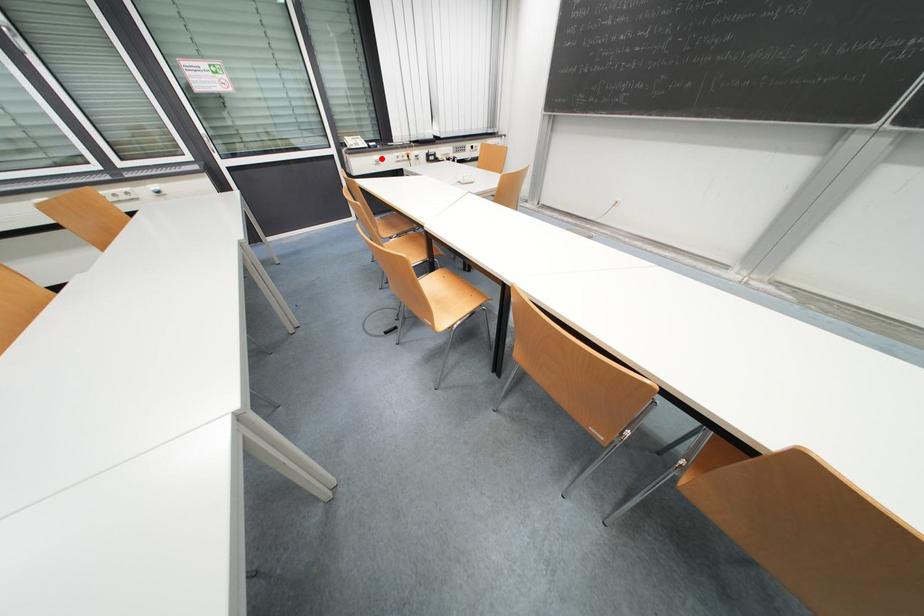
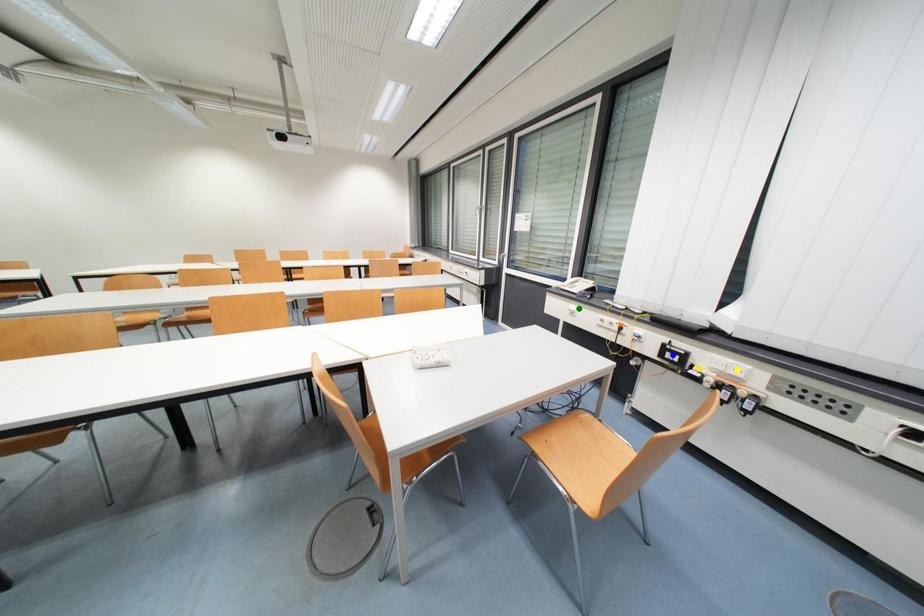
Question: I am providing you with two images of the same scene from different viewpoints. A red point is marked on the first image. You are given multiple points on the second image. Which point in image 2 is actually the same real-world point as the red point in image 1?

Choices:
 (A) blue point
 (B) yellow point
 (C) green point

Answer: (C)